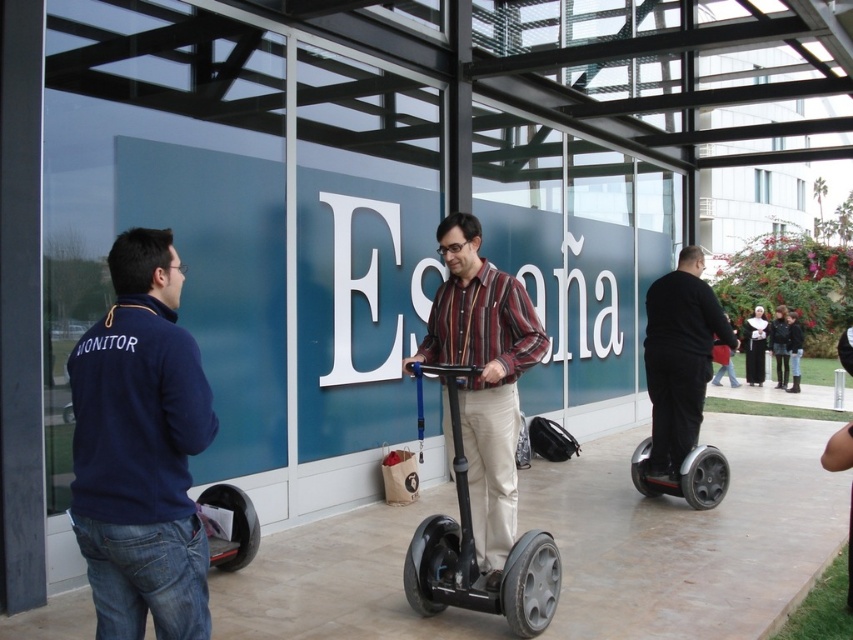
Does dark brown leather jacket at center have a greater width compared to dark gray fabric jacket at center?

Correct, the width of dark brown leather jacket at center exceeds that of dark gray fabric jacket at center.

In the scene shown: Does dark brown leather jacket at center lie behind dark gray fabric jacket at center?

No, dark brown leather jacket at center is in front of dark gray fabric jacket at center.

Is point (786, 378) farther from viewer compared to point (793, 332)?

No, (786, 378) is in front of (793, 332).

This screenshot has height=640, width=853. I want to click on dark brown leather jacket at center, so click(779, 344).

Which is below, black matte segway at right or dark brown nun's habit at right?

dark brown nun's habit at right is below.

Is point (677, 472) positioned in front of point (750, 360)?

Yes, point (677, 472) is in front of point (750, 360).

You are a GUI agent. You are given a task and a screenshot of the screen. Output one action in this format:
    pyautogui.click(x=<x>, y=<y>)
    Task: Click on the black matte segway at right
    
    Given the screenshot: What is the action you would take?
    pyautogui.click(x=679, y=358)

Can you confirm if dark blue fleece at left is positioned above black rubber scooter at right?

Correct, dark blue fleece at left is located above black rubber scooter at right.

Locate an element on the screen. This screenshot has width=853, height=640. dark blue fleece at left is located at coordinates (140, 449).

Find the location of a particular element. This screenshot has height=640, width=853. dark blue fleece at left is located at coordinates (140, 449).